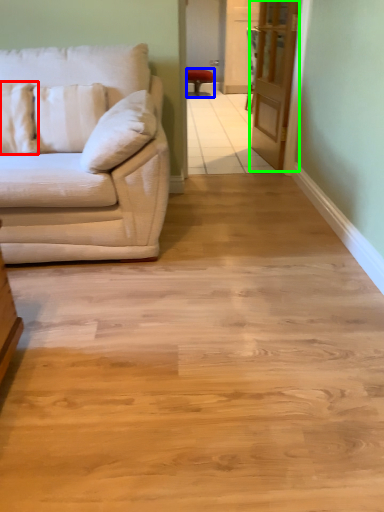
Question: Which object is the farthest from pillow (highlighted by a red box)? Choose among these: chair (highlighted by a blue box) or glass door (highlighted by a green box).

Choices:
 (A) chair
 (B) glass door

Answer: (A)